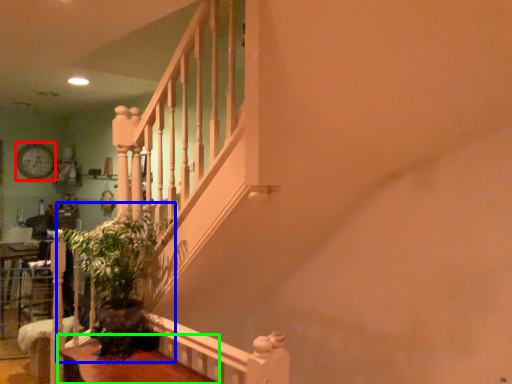
Question: Based on their relative distances, which object is nearer to clock (highlighted by a red box)? Choose from plant (highlighted by a blue box) and table (highlighted by a green box).

Choices:
 (A) plant
 (B) table

Answer: (A)